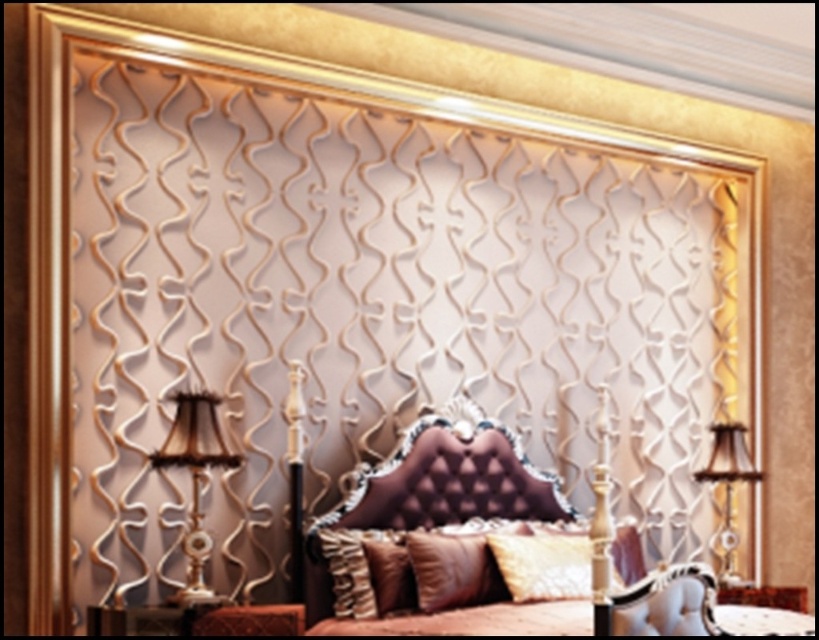
Is satin gold pillow at center closer to camera compared to velvet brown pillow at center?

No, it is behind velvet brown pillow at center.

Is point (528, 536) farther from viewer compared to point (324, 541)?

That is True.

Identify the location of satin gold pillow at center. The width and height of the screenshot is (819, 640). (543, 564).

Which is behind, point (192, 557) or point (528, 600)?

Point (528, 600)

Based on the photo, does gold textured lamp at left lie in front of satin gold pillow at center?

Yes, gold textured lamp at left is in front of satin gold pillow at center.

Is point (207, 442) positioned behind point (577, 586)?

No, (207, 442) is closer to viewer.

The image size is (819, 640). What are the coordinates of `gold textured lamp at left` in the screenshot? It's located at (193, 477).

Is matte gold lamp at right wider than velvet gold pillow at center?

In fact, matte gold lamp at right might be narrower than velvet gold pillow at center.

Measure the distance from matte gold lamp at right to velvet gold pillow at center.

matte gold lamp at right and velvet gold pillow at center are 30.39 inches apart.

Measure the distance between matte gold lamp at right and camera.

matte gold lamp at right is 5.84 meters from camera.

This screenshot has height=640, width=819. Find the location of `matte gold lamp at right`. matte gold lamp at right is located at coordinates (727, 488).